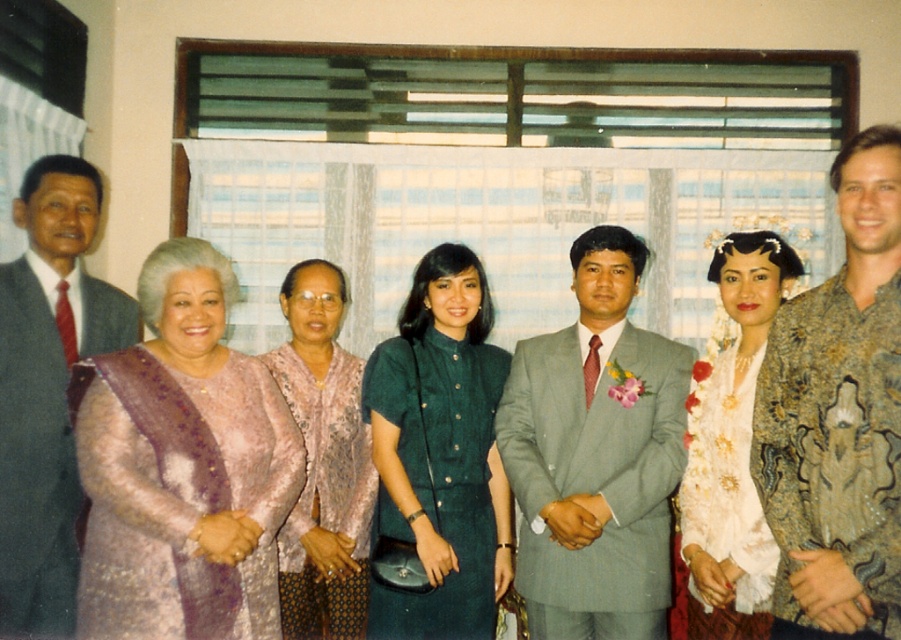
Which is behind, point (742, 248) or point (352, 417)?

The point (352, 417) is more distant.

I want to click on white lace dress at center, so click(x=731, y=449).

Is point (785, 272) positioned in front of point (331, 346)?

Yes, point (785, 272) is closer to viewer.

This screenshot has height=640, width=901. I want to click on white lace dress at center, so click(x=731, y=449).

Is batik shirt at center to the right of white lace dress at center from the viewer's perspective?

Indeed, batik shirt at center is positioned on the right side of white lace dress at center.

Between batik shirt at center and white lace dress at center, which one has less height?

white lace dress at center is shorter.

Where is `batik shirt at center`? The width and height of the screenshot is (901, 640). batik shirt at center is located at coordinates (x=838, y=417).

Can you confirm if green textured dress at center is positioned to the left of matte pink fabric at center?

In fact, green textured dress at center is to the right of matte pink fabric at center.

Does green textured dress at center appear under matte pink fabric at center?

No, green textured dress at center is not below matte pink fabric at center.

Identify the location of green textured dress at center. The image size is (901, 640). (440, 456).

This screenshot has width=901, height=640. I want to click on green textured dress at center, so click(x=440, y=456).